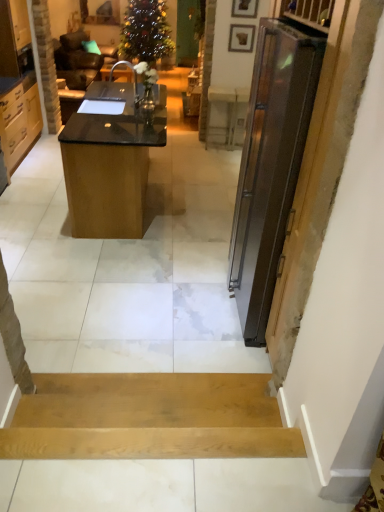
Question: Is light brown wood drawers at left, the first cabinetry in the top-to-bottom sequence, turned away from wooden picture frame at upper center, the 1th picture frame viewed from the front?

Choices:
 (A) no
 (B) yes

Answer: (A)

Question: Can you confirm if light brown wood drawers at left, the 2th cabinetry ordered from the bottom, is positioned to the right of wooden picture frame at upper center, which is the first picture frame in top-to-bottom order?

Choices:
 (A) no
 (B) yes

Answer: (A)

Question: Is light brown wood drawers at left, the first cabinetry in the top-to-bottom sequence, to the left of wooden picture frame at upper center, which is the first picture frame in top-to-bottom order, from the viewer's perspective?

Choices:
 (A) no
 (B) yes

Answer: (B)

Question: Is light brown wood drawers at left, the 2th cabinetry ordered from the bottom, taller than wooden picture frame at upper center, positioned as the 2th picture frame in bottom-to-top order?

Choices:
 (A) yes
 (B) no

Answer: (A)

Question: Does light brown wood drawers at left, the first cabinetry in the top-to-bottom sequence, have a lesser height compared to wooden picture frame at upper center, positioned as the 2th picture frame in bottom-to-top order?

Choices:
 (A) yes
 (B) no

Answer: (B)

Question: From the image's perspective, does light brown wood drawers at left, the first cabinetry in the top-to-bottom sequence, appear higher than wooden picture frame at upper center, which is the first picture frame in top-to-bottom order?

Choices:
 (A) yes
 (B) no

Answer: (B)

Question: Is black glossy desk at center taller than wooden picture frame at upper center, positioned as the 2th picture frame in bottom-to-top order?

Choices:
 (A) no
 (B) yes

Answer: (B)

Question: Is black glossy desk at center positioned behind wooden picture frame at upper center, which is the first picture frame in top-to-bottom order?

Choices:
 (A) no
 (B) yes

Answer: (A)

Question: From a real-world perspective, is black glossy desk at center positioned under wooden picture frame at upper center, the 1th picture frame viewed from the front, based on gravity?

Choices:
 (A) yes
 (B) no

Answer: (A)

Question: From the image's perspective, is black glossy desk at center on wooden picture frame at upper center, positioned as the 2th picture frame in bottom-to-top order?

Choices:
 (A) yes
 (B) no

Answer: (B)

Question: Considering the relative sizes of black glossy desk at center and wooden picture frame at upper center, the 2th picture frame viewed from the back, in the image provided, is black glossy desk at center smaller than wooden picture frame at upper center, the 2th picture frame viewed from the back,?

Choices:
 (A) no
 (B) yes

Answer: (A)

Question: Is black glossy desk at center shorter than wooden picture frame at upper center, which is the first picture frame in top-to-bottom order?

Choices:
 (A) yes
 (B) no

Answer: (B)

Question: Is wooden picture frame at upper center, which ranks as the second picture frame in top-to-bottom order, next to black glossy desk at center and touching it?

Choices:
 (A) yes
 (B) no

Answer: (B)